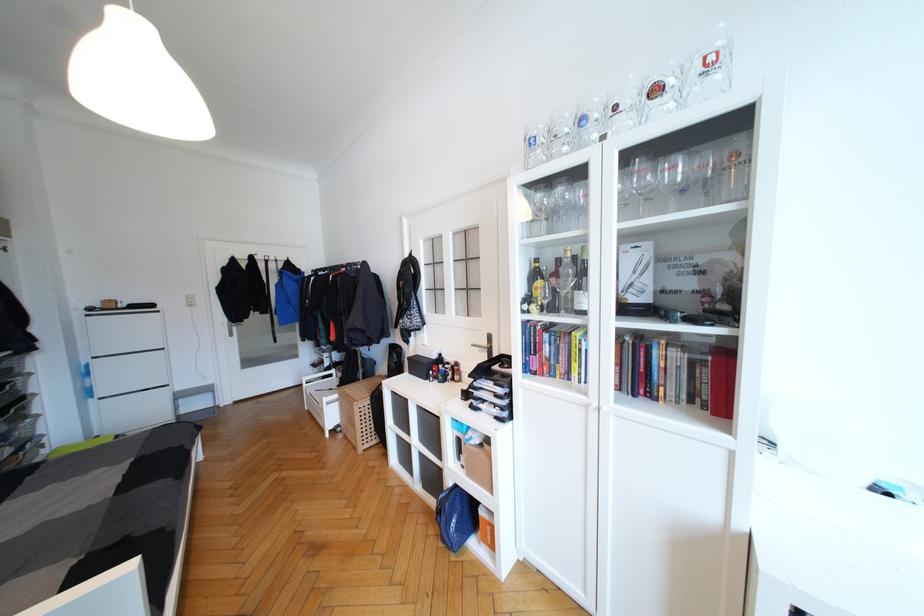
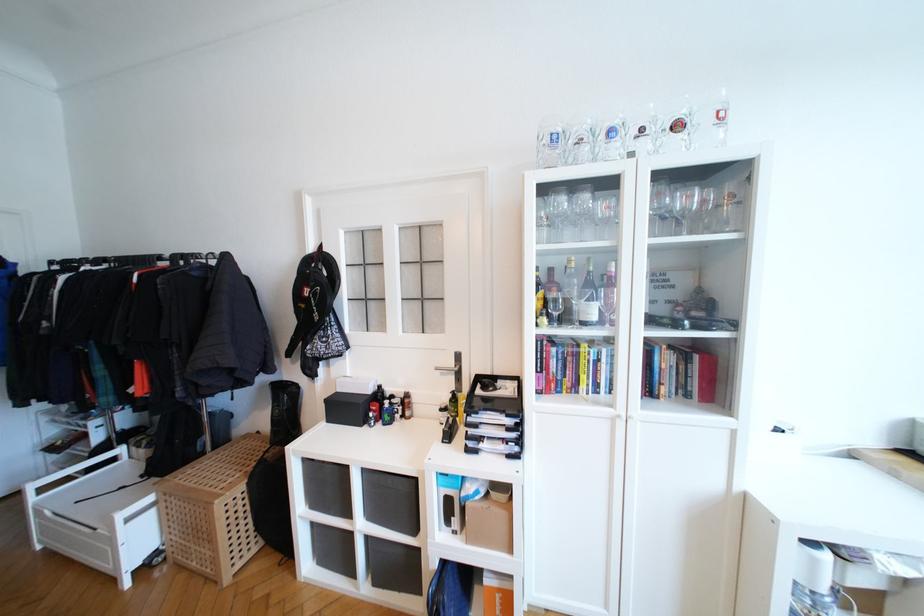
Find the pixel in the second image that matches point (549, 302) in the first image.

(558, 315)